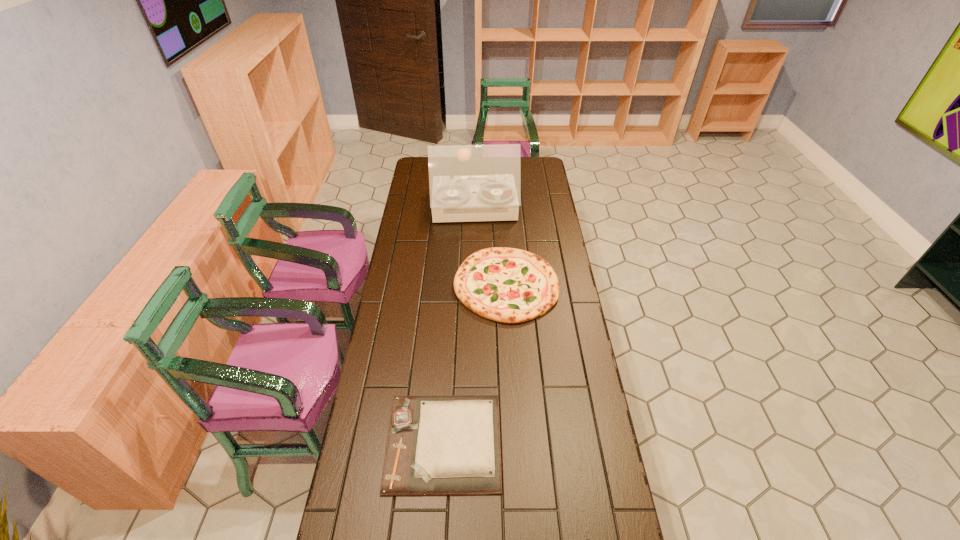
Locate an element on the screen. The height and width of the screenshot is (540, 960). object positioned at the right edge is located at coordinates (508, 285).

The height and width of the screenshot is (540, 960). In order to click on free space at the left edge of the desktop in this screenshot , I will do `click(423, 262)`.

This screenshot has width=960, height=540. Find the location of `vacant space at the right edge of the desktop`. vacant space at the right edge of the desktop is located at coordinates (552, 427).

The image size is (960, 540). I want to click on vacant region at the far right corner of the desktop, so click(545, 177).

Where is `vacant area between the farthest object and the clipboard`? This screenshot has height=540, width=960. vacant area between the farthest object and the clipboard is located at coordinates (459, 326).

Image resolution: width=960 pixels, height=540 pixels. I want to click on vacant point located between the tallest object and the pizza, so click(491, 247).

Identify which object is the closest to the clipboard. Please provide its 2D coordinates. Your answer should be formatted as a tuple, i.e. [(x, y)], where the tuple contains the x and y coordinates of a point satisfying the conditions above.

[(587, 539)]

Locate an element on the screen. The height and width of the screenshot is (540, 960). object identified as the second closest to the third nearest object is located at coordinates (449, 444).

The width and height of the screenshot is (960, 540). I want to click on blank area in the image that satisfies the following two spatial constraints: 1. on the front side of the second tallest object; 2. on the right side of the record player, so click(x=473, y=285).

Find the location of `vacant space that satisfies the following two spatial constraints: 1. on the back side of the record player; 2. on the right side of the second nearest object`. vacant space that satisfies the following two spatial constraints: 1. on the back side of the record player; 2. on the right side of the second nearest object is located at coordinates (458, 209).